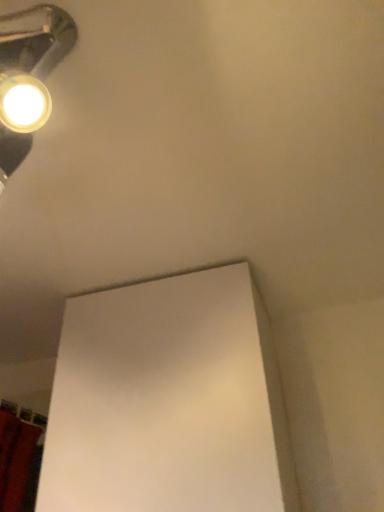
In order to click on metallic bulb at upper left in this screenshot , I will do `click(28, 76)`.

Describe the element at coordinates (28, 76) in the screenshot. I see `metallic bulb at upper left` at that location.

At what (x,y) coordinates should I click in order to perform the action: click on metallic bulb at upper left. Please return your answer as a coordinate pair (x, y). The width and height of the screenshot is (384, 512). Looking at the image, I should click on (28, 76).